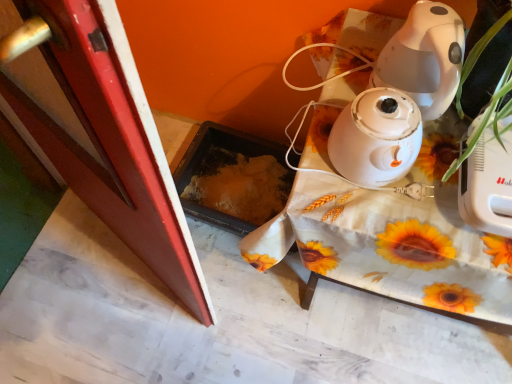
Identify the location of free space to the right of white glossy humidifier at center. The width and height of the screenshot is (512, 384). (435, 161).